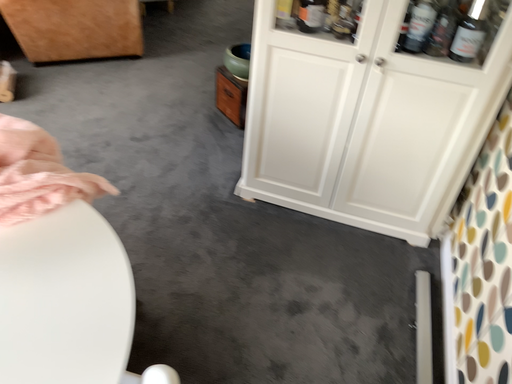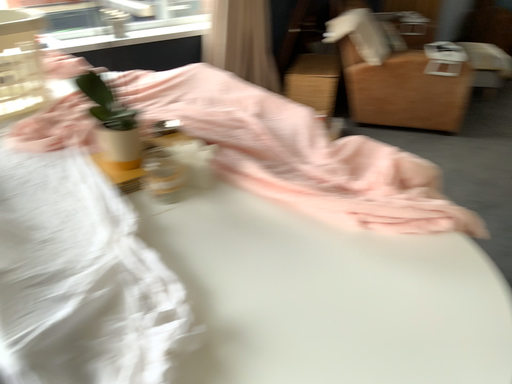
Question: Which way did the camera rotate in the video?

Choices:
 (A) rotated downward
 (B) rotated upward

Answer: (B)